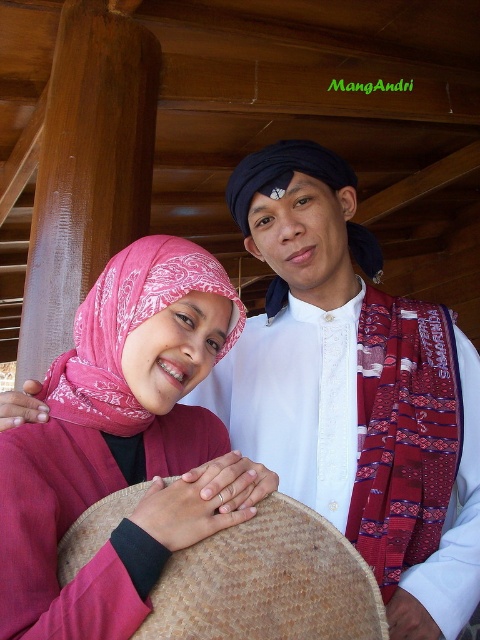
In the scene shown: You are an anthropologist observing the scene. Which headwear is taller between the pink fabric headscarf at upper left and the black woven turban at center?

The black woven turban at center is taller than the pink fabric headscarf at upper left.

You are an anthropologist observing two people in traditional attire. You notice both have head coverings labeled as the pink fabric headscarf at center and the black woven turban at center. Which head covering is taller?

The pink fabric headscarf at center is much taller than the black woven turban at center.